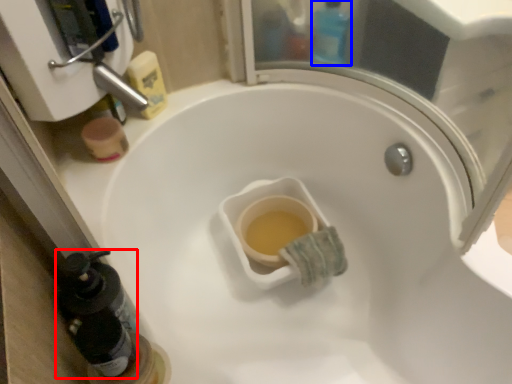
Question: Which of the following is the closest to the observer, bottle (highlighted by a red box) or bottle (highlighted by a blue box)?

Choices:
 (A) bottle
 (B) bottle

Answer: (A)